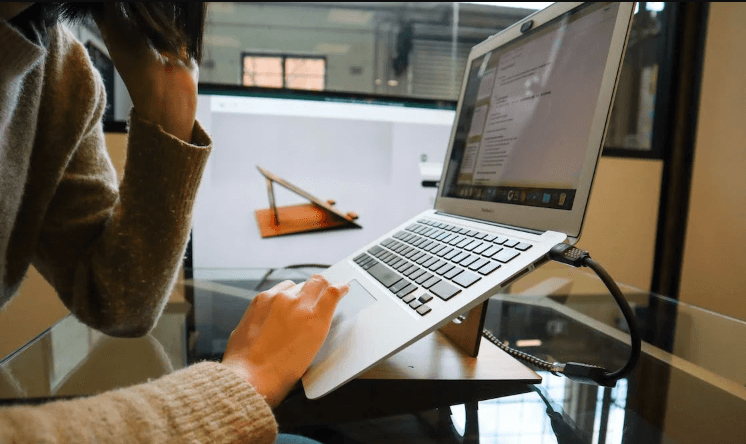
Locate an element on the screen. The width and height of the screenshot is (746, 444). laptop screen is located at coordinates (517, 133).